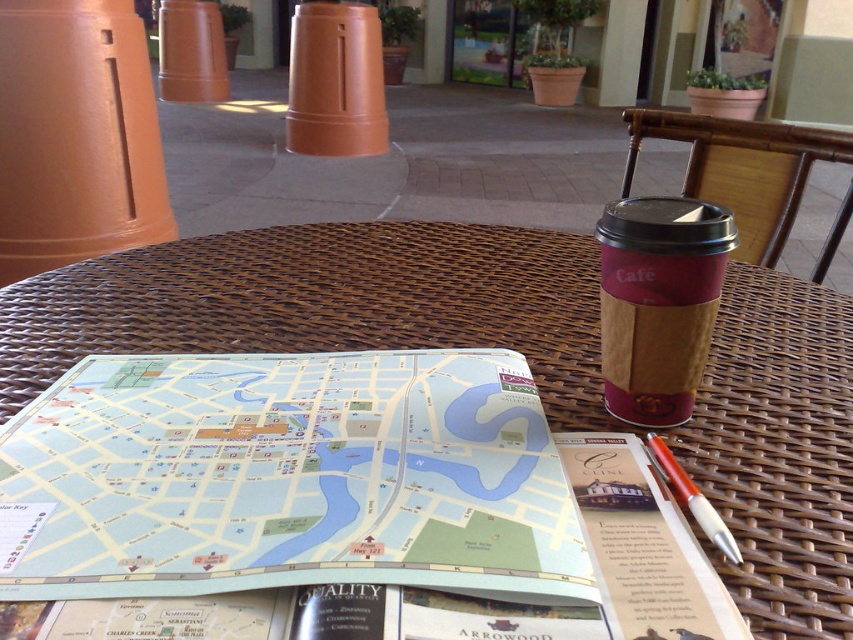
Question: Does light blue paper map at center appear on the left side of brown wicker table at center?

Choices:
 (A) no
 (B) yes

Answer: (B)

Question: Among these objects, which one is farthest from the camera?

Choices:
 (A) brown paper cup at upper right
 (B) orange pen at right
 (C) brown wicker table at center

Answer: (A)

Question: Does light blue paper map at center come behind orange pen at right?

Choices:
 (A) no
 (B) yes

Answer: (A)

Question: Which point appears farthest from the camera in this image?

Choices:
 (A) (149, 474)
 (B) (796, 628)

Answer: (A)

Question: Is light blue paper map at center above brown wicker table at center?

Choices:
 (A) no
 (B) yes

Answer: (A)

Question: Among these objects, which one is nearest to the camera?

Choices:
 (A) brown paper cup at upper right
 (B) light blue paper map at center
 (C) brown wicker table at center
 (D) orange pen at right

Answer: (B)